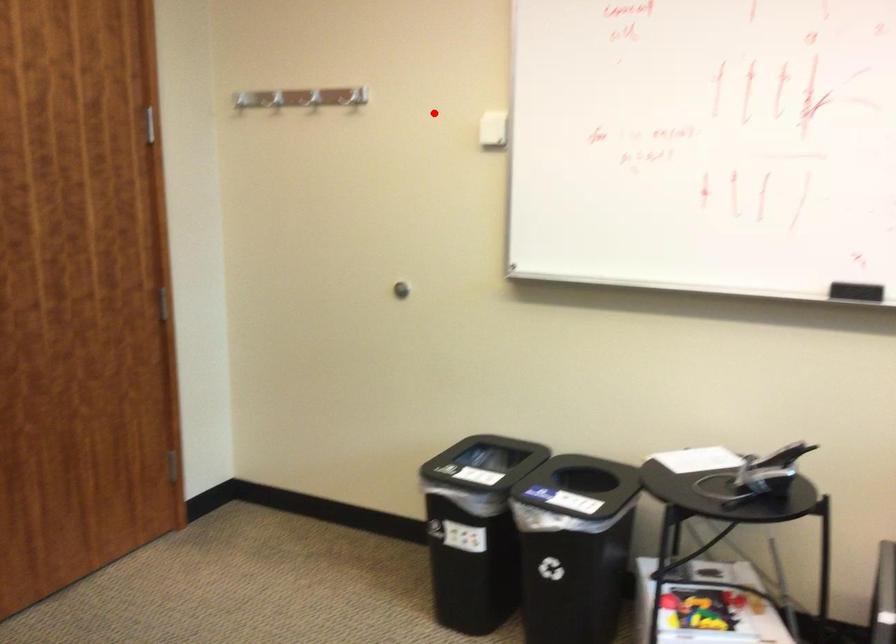
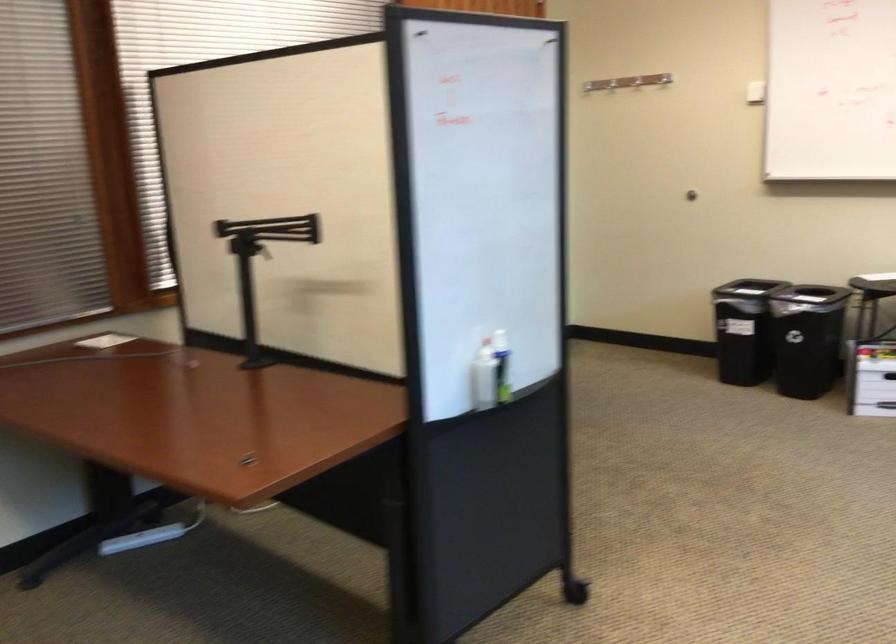
Question: I am providing you with two images of the same scene from different viewpoints. Image1 has a red point marked. In image2, the corresponding 3D location appears at what relative position? Reply with the corresponding letter.

Choices:
 (A) Closer
 (B) Farther

Answer: (B)